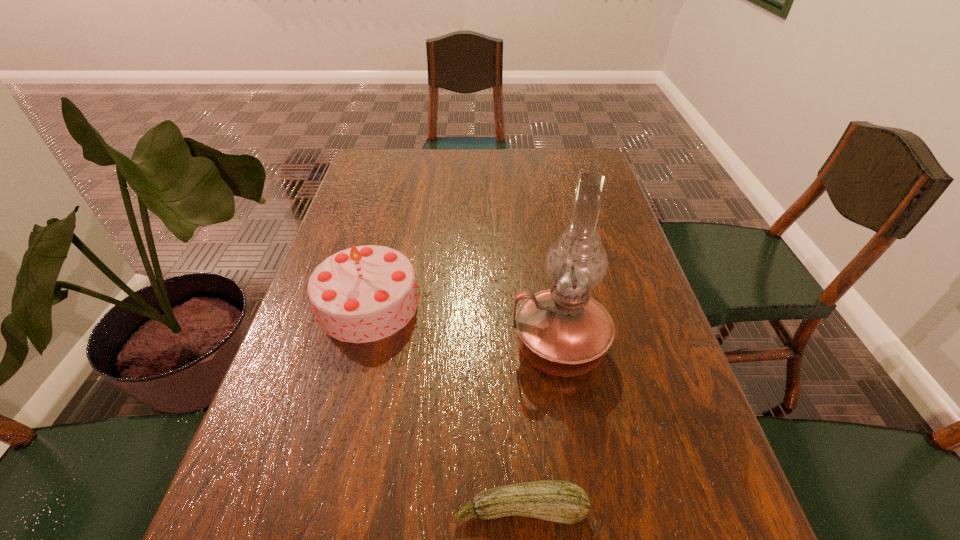
The image size is (960, 540). What are the coordinates of `vacant space at the left edge of the desktop` in the screenshot? It's located at (385, 202).

Find the location of `vacant space at the right edge of the desktop`. vacant space at the right edge of the desktop is located at coordinates (644, 407).

The image size is (960, 540). What are the coordinates of `free space at the far left corner` in the screenshot? It's located at (398, 149).

Where is `free region at the far right corner of the desktop`? free region at the far right corner of the desktop is located at coordinates (578, 161).

The image size is (960, 540). What are the coordinates of `vacant space that's between the leftmost object and the oil lamp` in the screenshot? It's located at (464, 325).

This screenshot has height=540, width=960. Find the location of `free space between the leftmost object and the oil lamp`. free space between the leftmost object and the oil lamp is located at coordinates point(464,325).

Where is `vacant space in between the shortest object and the leftmost object`? This screenshot has width=960, height=540. vacant space in between the shortest object and the leftmost object is located at coordinates (444, 406).

I want to click on free area in between the leftmost object and the nearest object, so click(x=444, y=406).

Image resolution: width=960 pixels, height=540 pixels. I want to click on vacant area between the second tallest object and the oil lamp, so click(464, 325).

At what (x,y) coordinates should I click in order to perform the action: click on unoccupied area between the leftmost object and the nearest object. Please return your answer as a coordinate pair (x, y). The height and width of the screenshot is (540, 960). Looking at the image, I should click on (444, 406).